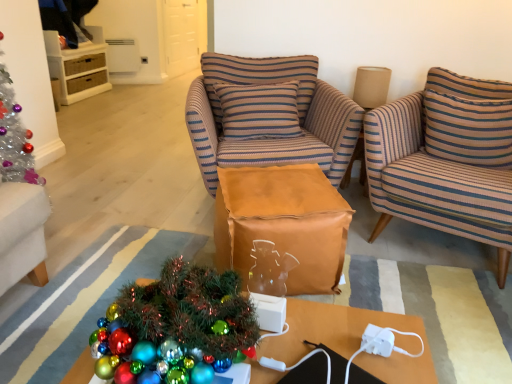
What are the coordinates of `empty space that is to the right of brown paper bag at center` in the screenshot? It's located at (395, 286).